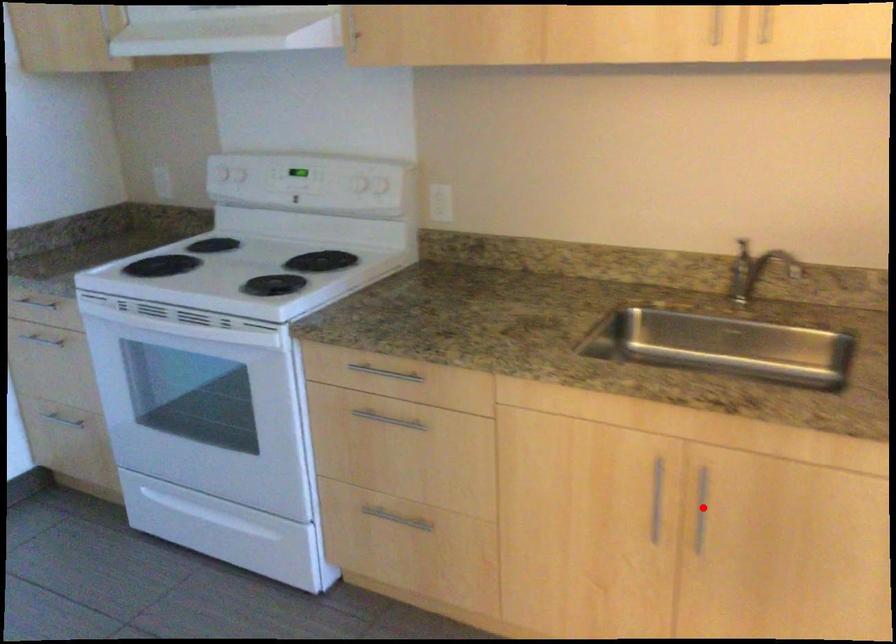
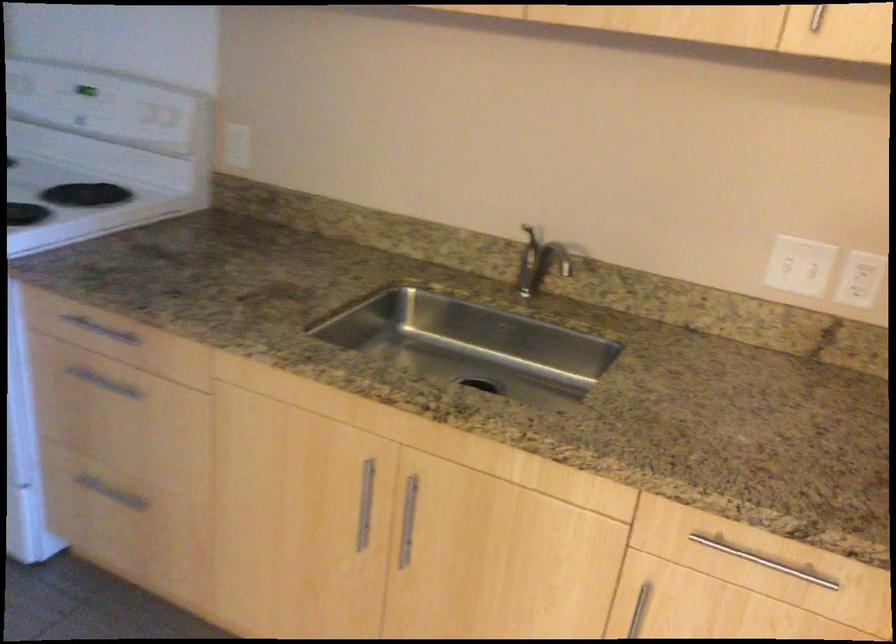
Find the pixel in the second image that matches the highlighted location in the first image.

(408, 520)